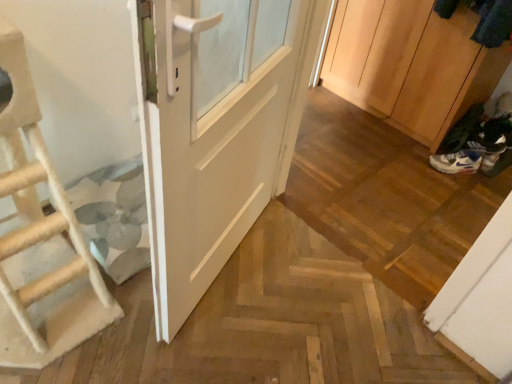
Question: Would you say white matte door at center is to the left or to the right of wooden cabinet at right in the picture?

Choices:
 (A) left
 (B) right

Answer: (A)

Question: Is white matte door at center in front of or behind wooden cabinet at right in the image?

Choices:
 (A) behind
 (B) front

Answer: (B)

Question: Based on their relative distances, which object is nearer to the white leather shoe at lower right?

Choices:
 (A) wooden cabinet at right
 (B) white mesh shoe at lower right
 (C) beige rope ladder at left
 (D) white matte door at center

Answer: (B)

Question: Estimate the real-world distances between objects in this image. Which object is farther from the white matte door at center?

Choices:
 (A) wooden cabinet at right
 (B) beige rope ladder at left
 (C) white mesh shoe at lower right
 (D) white leather shoe at lower right

Answer: (D)